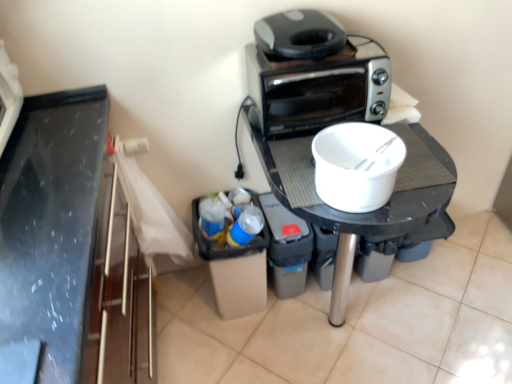
The image size is (512, 384). Describe the element at coordinates (298, 34) in the screenshot. I see `gray plastic toaster oven at upper right` at that location.

What do you see at coordinates (319, 88) in the screenshot?
I see `silver metallic toaster at upper center` at bounding box center [319, 88].

I want to click on black plastic table at center, so click(x=367, y=212).

Based on the photo, measure the distance between black plastic table at center and camera.

black plastic table at center is 39.14 inches from camera.

The height and width of the screenshot is (384, 512). Find the location of `gray plastic toaster oven at upper right`. gray plastic toaster oven at upper right is located at coordinates [x=298, y=34].

Does white matte bowl at center turn towards silver metallic toaster at upper center?

No, white matte bowl at center is not facing towards silver metallic toaster at upper center.

Is white matte bowl at center far away from silver metallic toaster at upper center?

No, there isn't a large distance between white matte bowl at center and silver metallic toaster at upper center.

Identify the location of toaster on the left of white matte bowl at center. (319, 88).

From a real-world perspective, which object rests below the other?

white matte bowl at center is physically lower.

Considering the relative sizes of black plastic trash can at lower center and gray plastic toaster oven at upper right in the image provided, is black plastic trash can at lower center wider than gray plastic toaster oven at upper right?

Correct, the width of black plastic trash can at lower center exceeds that of gray plastic toaster oven at upper right.

Looking at this image, from a real-world perspective, is black plastic trash can at lower center physically located above or below gray plastic toaster oven at upper right?

In terms of real-world spatial position, black plastic trash can at lower center is below gray plastic toaster oven at upper right.

Considering the sizes of objects black plastic trash can at lower center and gray plastic toaster oven at upper right in the image provided, who is bigger, black plastic trash can at lower center or gray plastic toaster oven at upper right?

Bigger between the two is black plastic trash can at lower center.

Can you tell me how much black plastic trash can at lower center and gray plastic toaster oven at upper right differ in facing direction?

The angular difference between black plastic trash can at lower center and gray plastic toaster oven at upper right is 2.09 degrees.

Does black plastic table at center turn towards silver metallic toaster at upper center?

No.

Which of these two, black plastic table at center or silver metallic toaster at upper center, stands taller?

black plastic table at center.

Which object is wider, black plastic table at center or silver metallic toaster at upper center?

With larger width is black plastic table at center.

Identify the location of table in front of the silver metallic toaster at upper center. This screenshot has width=512, height=384. (367, 212).

Could you tell me if silver metallic toaster at upper center is turned towards gray plastic toaster oven at upper right?

No, silver metallic toaster at upper center does not turn towards gray plastic toaster oven at upper right.

Between silver metallic toaster at upper center and gray plastic toaster oven at upper right, which one has more height?

Standing taller between the two is silver metallic toaster at upper center.

Is silver metallic toaster at upper center inside or outside of gray plastic toaster oven at upper right?

silver metallic toaster at upper center is not inside gray plastic toaster oven at upper right, it's outside.

Considering the sizes of objects white matte bowl at center and black plastic trash can at lower center in the image provided, who is bigger, white matte bowl at center or black plastic trash can at lower center?

Bigger between the two is black plastic trash can at lower center.

Is point (361, 137) closer or farther from the camera than point (293, 220)?

Point (361, 137) is positioned closer to the camera compared to point (293, 220).

From a real-world perspective, who is located lower, white matte bowl at center or black plastic trash can at lower center?

black plastic trash can at lower center.

In terms of width, does silver metallic toaster at upper center look wider or thinner when compared to black plastic trash can at lower center?

Clearly, silver metallic toaster at upper center has less width compared to black plastic trash can at lower center.

Would you say silver metallic toaster at upper center is to the left or to the right of black plastic trash can at lower center in the picture?

In the image, silver metallic toaster at upper center appears on the right side of black plastic trash can at lower center.

Is silver metallic toaster at upper center positioned far away from black plastic trash can at lower center?

No, there isn't a large distance between silver metallic toaster at upper center and black plastic trash can at lower center.

In the scene shown: Which of these two, silver metallic toaster at upper center or black plastic trash can at lower center, stands shorter?

Standing shorter between the two is silver metallic toaster at upper center.

Locate an element on the screen. This screenshot has width=512, height=384. home appliance above the black plastic table at center (from the image's perspective) is located at coordinates (298, 34).

From the image's perspective, between black plastic table at center and gray plastic toaster oven at upper right, who is located below?

black plastic table at center, from the image's perspective.

Do you think black plastic table at center is within gray plastic toaster oven at upper right, or outside of it?

black plastic table at center is outside gray plastic toaster oven at upper right.

Who is bigger, black plastic table at center or gray plastic toaster oven at upper right?

black plastic table at center is bigger.

Locate an element on the screen. The image size is (512, 384). kitchen appliance below the silver metallic toaster at upper center (from the image's perspective) is located at coordinates (356, 165).

This screenshot has width=512, height=384. In order to click on home appliance lying above the black plastic trash can at lower center (from the image's perspective) in this screenshot , I will do `click(298, 34)`.

Looking at the image, which one is located further to black plastic table at center, white matte bowl at center or black plastic trash can at lower center?

The object further to black plastic table at center is black plastic trash can at lower center.

Looking at the image, which one is located further to black plastic trash can at lower center, gray plastic toaster oven at upper right or white matte bowl at center?

Among the two, gray plastic toaster oven at upper right is located further to black plastic trash can at lower center.

From the image, which object appears to be nearer to black plastic table at center, white matte bowl at center or silver metallic toaster at upper center?

white matte bowl at center is positioned closer to the anchor black plastic table at center.

From the picture: Which object lies further to the anchor point silver metallic toaster at upper center, black plastic table at center or black plastic trash can at lower center?

black plastic trash can at lower center is further to silver metallic toaster at upper center.

Considering their positions, is black plastic trash can at lower center positioned closer to black plastic table at center than silver metallic toaster at upper center?

Among the two, silver metallic toaster at upper center is located nearer to black plastic table at center.

Considering their positions, is black plastic trash can at lower center positioned further to white matte bowl at center than silver metallic toaster at upper center?

Based on the image, black plastic trash can at lower center appears to be further to white matte bowl at center.

From the image, which object appears to be farther from gray plastic toaster oven at upper right, black plastic table at center or silver metallic toaster at upper center?

black plastic table at center is further to gray plastic toaster oven at upper right.

When comparing their distances from gray plastic toaster oven at upper right, does black plastic trash can at lower center or white matte bowl at center seem further?

black plastic trash can at lower center is positioned further to the anchor gray plastic toaster oven at upper right.

Image resolution: width=512 pixels, height=384 pixels. What are the coordinates of `kitchen appliance between gray plastic toaster oven at upper right and black plastic table at center in the vertical direction` in the screenshot? It's located at (356, 165).

The image size is (512, 384). I want to click on toaster between white matte bowl at center and black plastic trash can at lower center from front to back, so click(319, 88).

Locate an element on the screen. toaster between gray plastic toaster oven at upper right and white matte bowl at center in the up-down direction is located at coordinates (319, 88).

Locate an element on the screen. This screenshot has height=384, width=512. table that lies between silver metallic toaster at upper center and black plastic trash can at lower center from top to bottom is located at coordinates pyautogui.click(x=367, y=212).